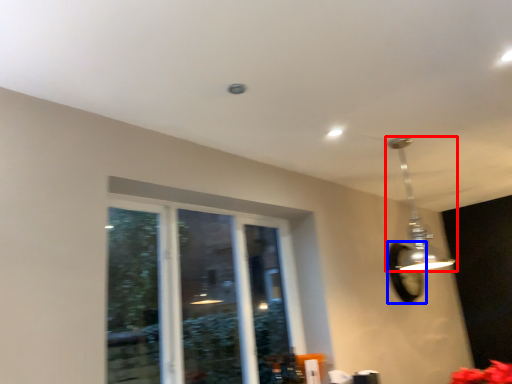
Question: Among these objects, which one is farthest to the camera, lamp (highlighted by a red box) or mirror (highlighted by a blue box)?

Choices:
 (A) lamp
 (B) mirror

Answer: (B)